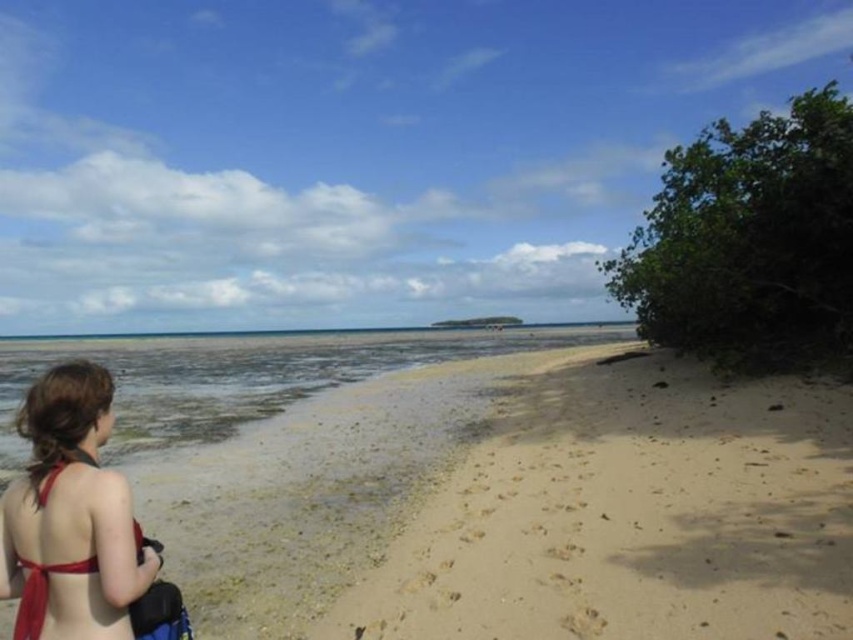
You are standing on the beach and want to place a small umbrella between the light tan sand at center and the clear water at lower left. Based on their positions, which object should you place the umbrella closer to?

The light tan sand at center is closer to the viewer than the clear water at lower left, so you should place the umbrella closer to the light tan sand at center to ensure it remains visible and stable.

You are standing at the point marked as point (630, 515) on the beach. Looking around, you see light tan sand at center. Which direction should you walk to reach the person in the red bikini top on the left side?

The person in the red bikini top on the left side is to the left of your current position at point (630, 515), so you should walk towards the left to reach them.